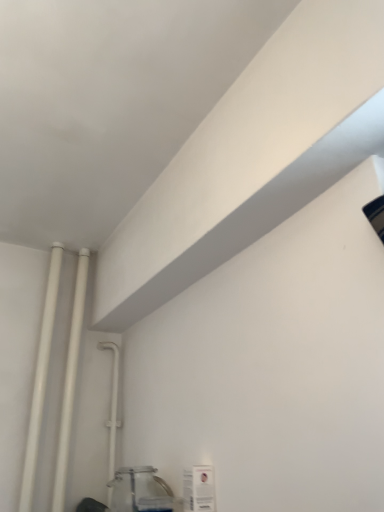
Question: Is white matte pipe at left, marked as the first pipe in a left-to-right arrangement, positioned behind white plastic pipe at upper left, marked as the first pipe in a right-to-left arrangement?

Choices:
 (A) yes
 (B) no

Answer: (B)

Question: Is white matte pipe at left, marked as the first pipe in a left-to-right arrangement, thinner than white plastic pipe at upper left, placed as the 3th pipe when sorted from left to right?

Choices:
 (A) no
 (B) yes

Answer: (B)

Question: Can you confirm if white matte pipe at left, the 3th pipe from the right, is bigger than white plastic pipe at upper left, marked as the first pipe in a right-to-left arrangement?

Choices:
 (A) no
 (B) yes

Answer: (A)

Question: Can you confirm if white matte pipe at left, marked as the first pipe in a left-to-right arrangement, is positioned to the left of white plastic pipe at upper left, marked as the first pipe in a right-to-left arrangement?

Choices:
 (A) yes
 (B) no

Answer: (A)

Question: Is white matte pipe at left, marked as the first pipe in a left-to-right arrangement, oriented away from white plastic pipe at upper left, placed as the 3th pipe when sorted from left to right?

Choices:
 (A) yes
 (B) no

Answer: (B)

Question: Is white matte pipe at left, marked as the first pipe in a left-to-right arrangement, to the right of white plastic pipe at upper left, marked as the first pipe in a right-to-left arrangement, from the viewer's perspective?

Choices:
 (A) yes
 (B) no

Answer: (B)

Question: Is white matte pipe at left, marked as the first pipe in a left-to-right arrangement, at the back of white glossy pipes at left, positioned as the second pipe in left-to-right order?

Choices:
 (A) yes
 (B) no

Answer: (B)

Question: From the image's perspective, would you say white glossy pipes at left, the 2th pipe when ordered from right to left, is shown under white matte pipe at left, the 3th pipe from the right?

Choices:
 (A) no
 (B) yes

Answer: (B)

Question: Is white glossy pipes at left, the 2th pipe when ordered from right to left, not near white matte pipe at left, the 3th pipe from the right?

Choices:
 (A) yes
 (B) no

Answer: (B)

Question: Does white glossy pipes at left, the 2th pipe when ordered from right to left, have a smaller size compared to white matte pipe at left, the 3th pipe from the right?

Choices:
 (A) no
 (B) yes

Answer: (A)

Question: Does white glossy pipes at left, positioned as the second pipe in left-to-right order, lie in front of white matte pipe at left, the 3th pipe from the right?

Choices:
 (A) no
 (B) yes

Answer: (A)

Question: Considering the relative sizes of white glossy pipes at left, the 2th pipe when ordered from right to left, and white matte pipe at left, marked as the first pipe in a left-to-right arrangement, in the image provided, is white glossy pipes at left, the 2th pipe when ordered from right to left, thinner than white matte pipe at left, marked as the first pipe in a left-to-right arrangement,?

Choices:
 (A) no
 (B) yes

Answer: (A)

Question: From a real-world perspective, is white glossy pipes at left, positioned as the second pipe in left-to-right order, on clear glass jar at lower left?

Choices:
 (A) no
 (B) yes

Answer: (B)